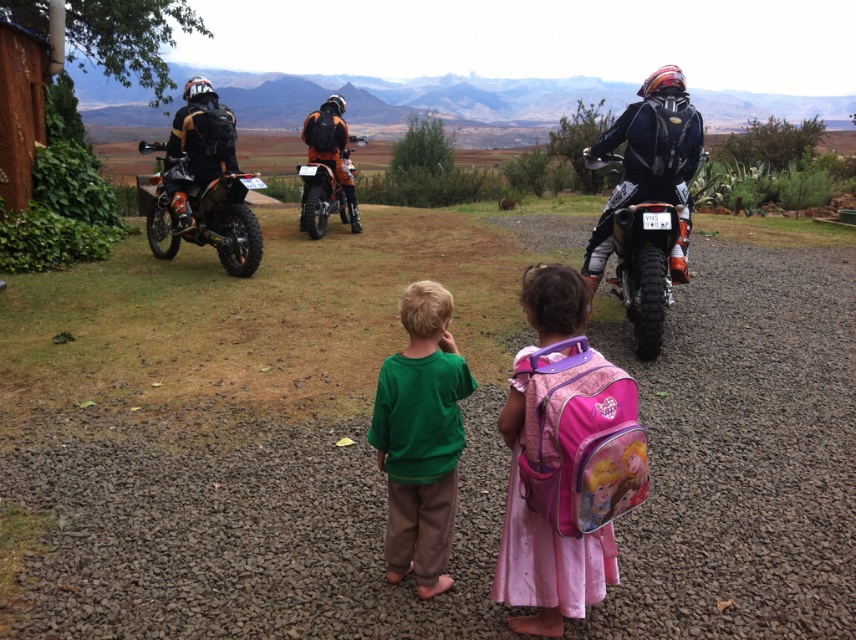
Question: Which of the following is the farthest from the observer?

Choices:
 (A) orange matte motorcycle at center
 (B) orange matte motorcycle at right

Answer: (A)

Question: Estimate the real-world distances between objects in this image. Which object is farther from the pink fabric backpack at center?

Choices:
 (A) orange matte motorcycle at right
 (B) orange matte motorcycle at center
 (C) orange metallic dirt bike at left

Answer: (B)

Question: Which point appears farthest from the camera in this image?

Choices:
 (A) (638, 220)
 (B) (419, 630)
 (C) (336, 184)
 (D) (553, 333)

Answer: (C)

Question: Is pink fabric backpack at center further to the viewer compared to orange matte motorcycle at right?

Choices:
 (A) no
 (B) yes

Answer: (A)

Question: Can you confirm if green cotton shirt at center is smaller than orange matte motorcycle at right?

Choices:
 (A) yes
 (B) no

Answer: (A)

Question: In this image, where is orange matte motorcycle at right located relative to orange metallic dirt bike at left?

Choices:
 (A) left
 (B) right

Answer: (B)